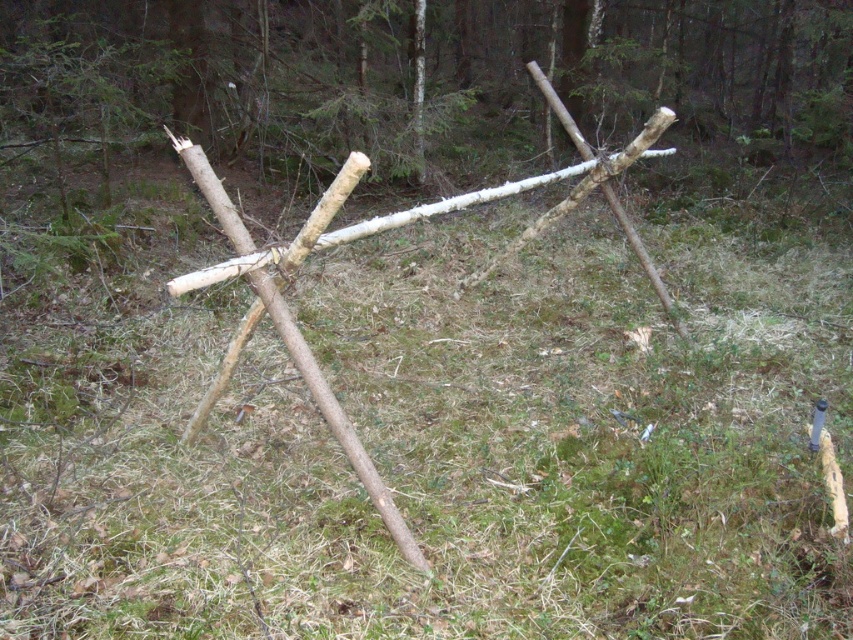
You are a hiker who needs to cross a small stream. You have a natural wood stick at center to use as a walking aid. If you step on the green grass at center, will the grass be narrower than the stick in width?

The green grass at center has a width less than the natural wood stick at center, so yes, the grass is narrower than the stick in width.

You are a hiker who needs to determine the relative sizes of two items in the forest scene. Looking at the green grass at center and the natural wood stick at center, which one is larger?

The natural wood stick at center is larger than the green grass at center.

You are standing at the point marked as point (18, 342) in the forest. You want to throw a small pebble to reach a tree located 5 meters away from your current position. Will the pebble be able to reach the tree?

The distance between you and the tree is 5 meters, but the point marked as point (18, 342) is only 3.93 meters away from the viewer. Therefore, the pebble thrown from your current position can reach the tree since 5 meters is within the possible range.